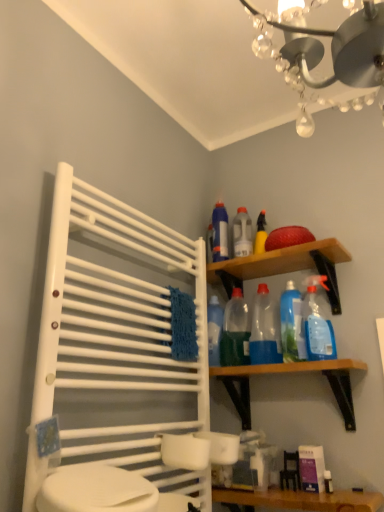
Question: Is wooden shelf at upper right, which is the 2th shelf from bottom to top, not inside wooden vanity at lower center?

Choices:
 (A) yes
 (B) no

Answer: (A)

Question: Is wooden shelf at upper right, which is the 2th shelf from bottom to top, positioned with its back to wooden vanity at lower center?

Choices:
 (A) no
 (B) yes

Answer: (A)

Question: Is wooden shelf at upper right, which is the 2th shelf from bottom to top, at the left side of wooden vanity at lower center?

Choices:
 (A) yes
 (B) no

Answer: (A)

Question: From a real-world perspective, is wooden shelf at upper right, which is the 2th shelf from bottom to top, physically above wooden vanity at lower center?

Choices:
 (A) no
 (B) yes

Answer: (B)

Question: Is wooden shelf at upper right, which is the 2th shelf from bottom to top, to the right of wooden vanity at lower center from the viewer's perspective?

Choices:
 (A) yes
 (B) no

Answer: (B)

Question: From a real-world perspective, is white plastic towel rack at left positioned above or below wooden shelf at upper right, the first shelf when ordered from top to bottom?

Choices:
 (A) below
 (B) above

Answer: (A)

Question: Based on their positions, is white plastic towel rack at left located to the left or right of wooden shelf at upper right, which is the 2th shelf from bottom to top?

Choices:
 (A) right
 (B) left

Answer: (B)

Question: In terms of height, does white plastic towel rack at left look taller or shorter compared to wooden shelf at upper right, the first shelf when ordered from top to bottom?

Choices:
 (A) tall
 (B) short

Answer: (A)

Question: Is point (84, 361) closer or farther from the camera than point (349, 257)?

Choices:
 (A) closer
 (B) farther

Answer: (A)

Question: Considering the positions of wooden vanity at lower center and translucent plastic spray bottle at upper right, the first cleaning product viewed from the right, in the image, is wooden vanity at lower center bigger or smaller than translucent plastic spray bottle at upper right, the first cleaning product viewed from the right,?

Choices:
 (A) big
 (B) small

Answer: (A)

Question: Would you say wooden vanity at lower center is to the left or to the right of translucent plastic spray bottle at upper right, which ranks as the fourth cleaning product in left-to-right order, in the picture?

Choices:
 (A) right
 (B) left

Answer: (B)

Question: Is point (249, 492) positioned closer to the camera than point (327, 325)?

Choices:
 (A) farther
 (B) closer

Answer: (B)

Question: Relative to translucent plastic spray bottle at upper right, which ranks as the fourth cleaning product in left-to-right order, is wooden vanity at lower center in front or behind?

Choices:
 (A) behind
 (B) front

Answer: (B)

Question: Is point (332, 253) closer or farther from the camera than point (331, 333)?

Choices:
 (A) closer
 (B) farther

Answer: (B)

Question: From a real-world perspective, is wooden shelf at upper right, which is the 2th shelf from bottom to top, positioned above or below translucent plastic spray bottle at upper right, which ranks as the fourth cleaning product in left-to-right order?

Choices:
 (A) below
 (B) above

Answer: (B)